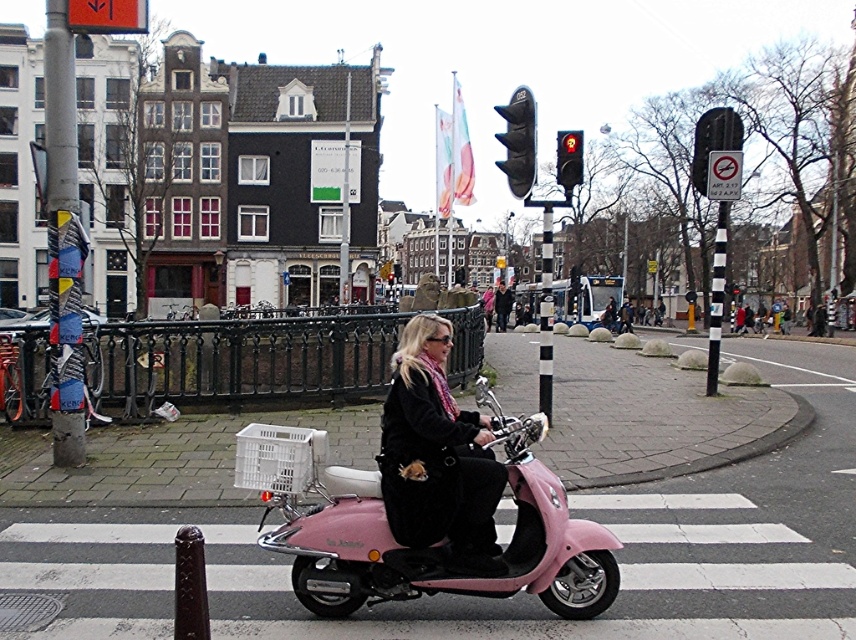
Does pink matte scooter at center have a greater height compared to velvet black coat at center?

In fact, pink matte scooter at center may be shorter than velvet black coat at center.

Does point (592, 534) come farther from viewer compared to point (443, 394)?

No.

Who is more forward, (414, 550) or (441, 362)?

Point (414, 550)

Locate an element on the screen. This screenshot has width=856, height=640. pink matte scooter at center is located at coordinates (443, 538).

Does point (489, 419) lie behind point (521, 170)?

No.

Which is above, velvet black coat at center or black plastic traffic light at upper center?

black plastic traffic light at upper center

The image size is (856, 640). What do you see at coordinates (437, 458) in the screenshot? I see `velvet black coat at center` at bounding box center [437, 458].

Identify the location of velvet black coat at center. (437, 458).

Between pink matte scooter at center and black plastic traffic light at upper center, which one is positioned higher?

black plastic traffic light at upper center is above.

Is point (473, 449) in front of point (500, 163)?

Yes, it is.

I want to click on pink matte scooter at center, so click(443, 538).